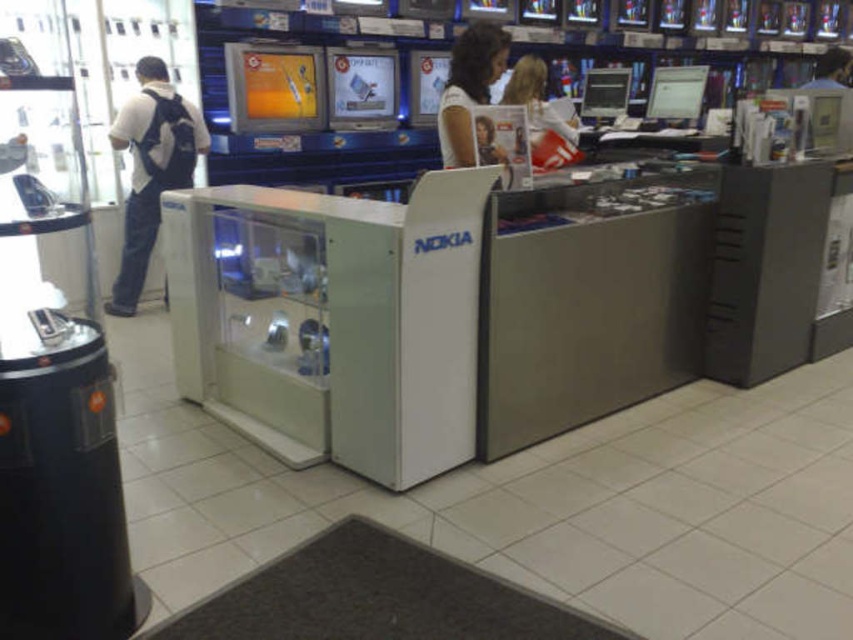
Question: Is white fabric backpack at left thinner than blonde hair at center?

Choices:
 (A) no
 (B) yes

Answer: (A)

Question: Can you confirm if white fabric backpack at left is smaller than blonde hair at center?

Choices:
 (A) yes
 (B) no

Answer: (B)

Question: Which object is farther from the camera taking this photo?

Choices:
 (A) white fabric backpack at left
 (B) blonde hair at center

Answer: (A)

Question: Among these points, which one is nearest to the camera?

Choices:
 (A) (525, 76)
 (B) (184, 182)

Answer: (A)

Question: Can you confirm if white fabric backpack at left is positioned below blonde hair at center?

Choices:
 (A) yes
 (B) no

Answer: (A)

Question: Which point appears farthest from the camera in this image?

Choices:
 (A) (518, 76)
 (B) (161, 115)

Answer: (B)